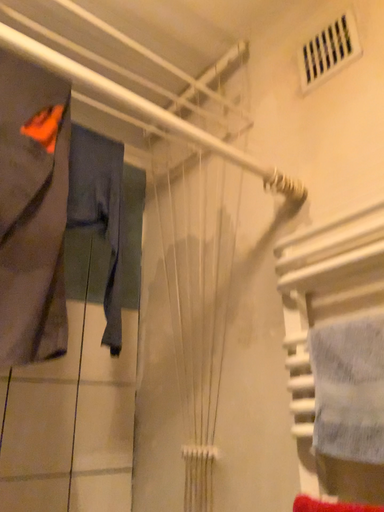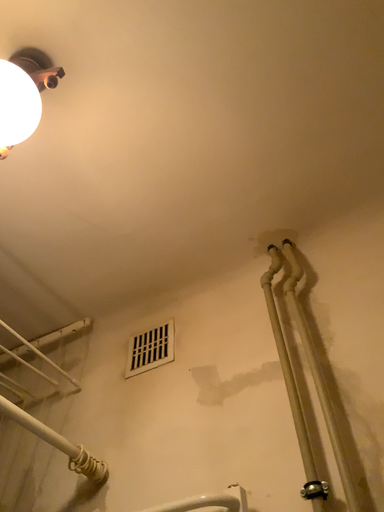
Question: Which way did the camera rotate in the video?

Choices:
 (A) rotated downward
 (B) rotated upward

Answer: (B)